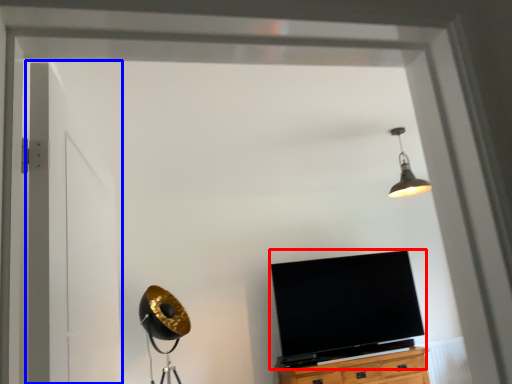
Question: Which point is further to the camera, television (highlighted by a red box) or door (highlighted by a blue box)?

Choices:
 (A) television
 (B) door

Answer: (A)